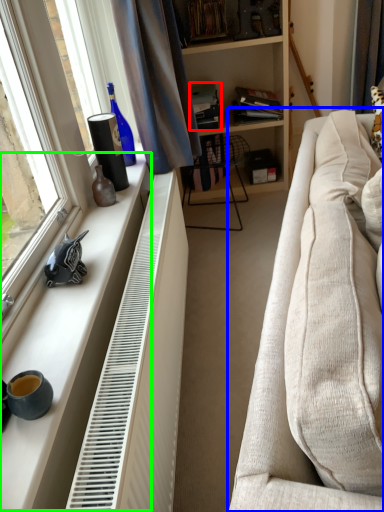
Question: Which is nearer to the book (highlighted by a red box)? studio couch (highlighted by a blue box) or window sill (highlighted by a green box).

Choices:
 (A) studio couch
 (B) window sill

Answer: (A)